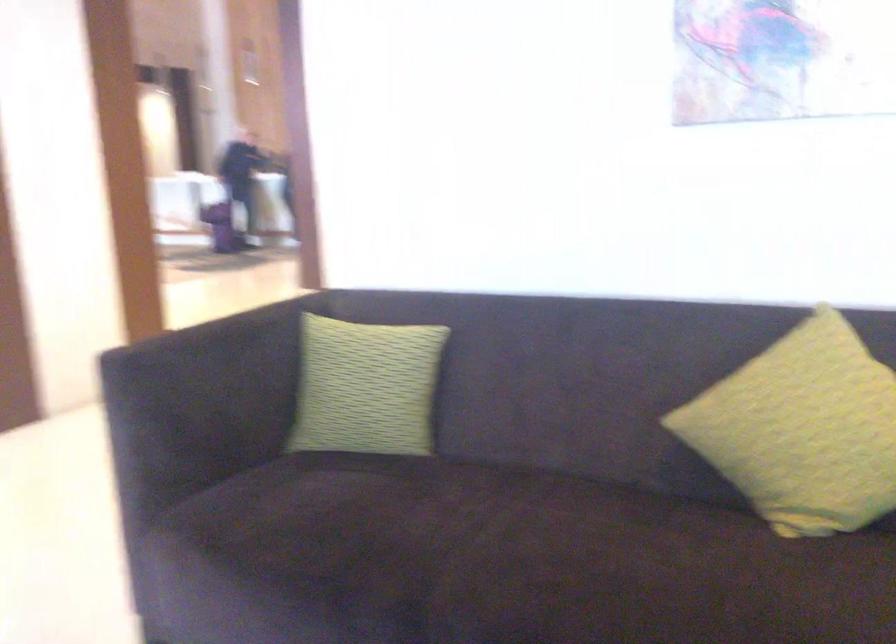
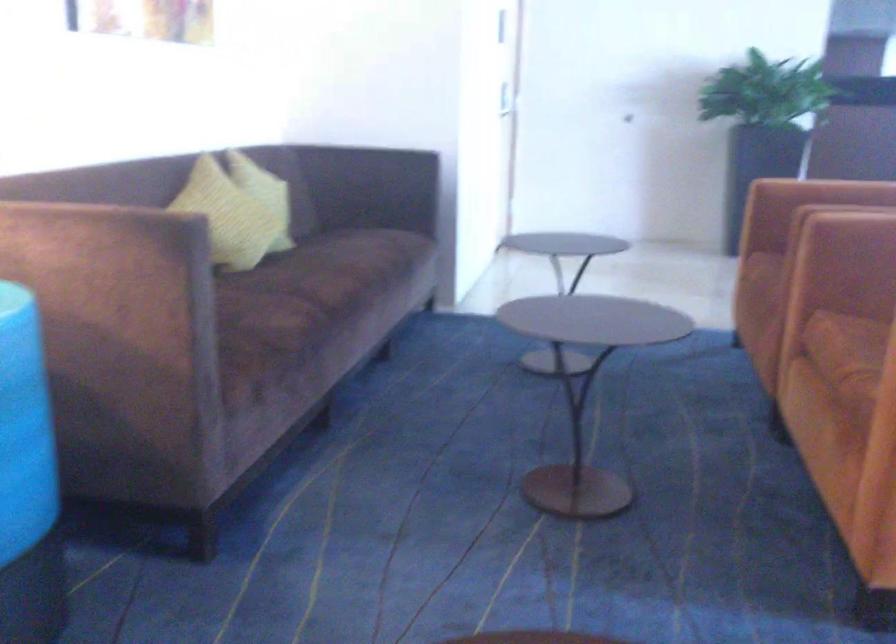
Question: The camera is either moving clockwise (left) or counter-clockwise (right) around the object. The first image is from the beginning of the video and the second image is from the end. Is the camera moving left or right when shooting the video?

Choices:
 (A) Left
 (B) Right

Answer: (A)